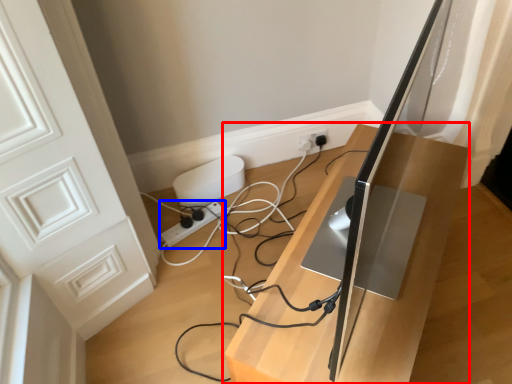
Question: Among these objects, which one is nearest to the camera, furniture (highlighted by a red box) or extension cord (highlighted by a blue box)?

Choices:
 (A) furniture
 (B) extension cord

Answer: (A)